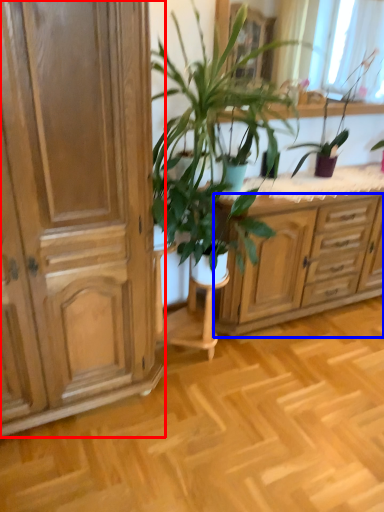
Question: Which of the following is the farthest to the observer, cabinetry (highlighted by a red box) or chest of drawers (highlighted by a blue box)?

Choices:
 (A) cabinetry
 (B) chest of drawers

Answer: (B)